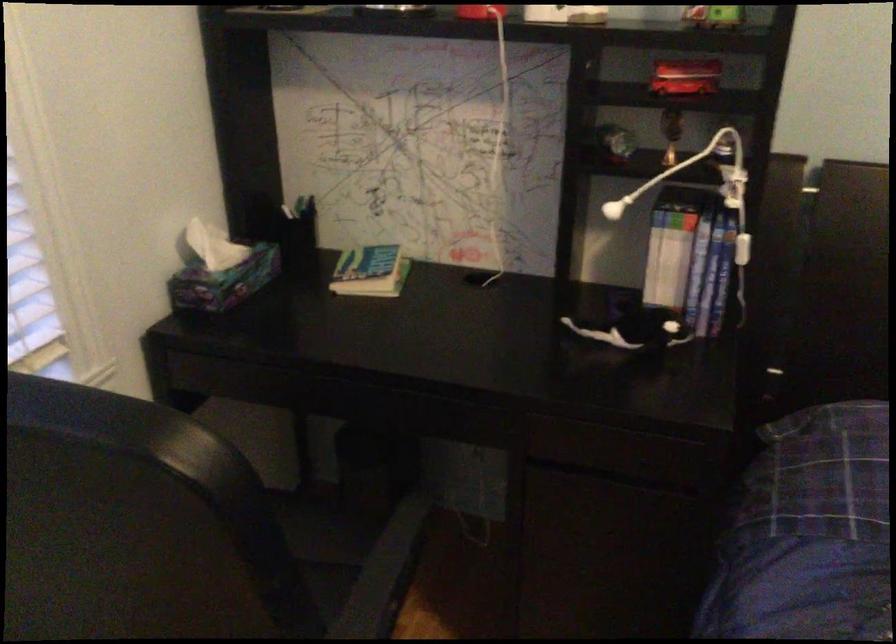
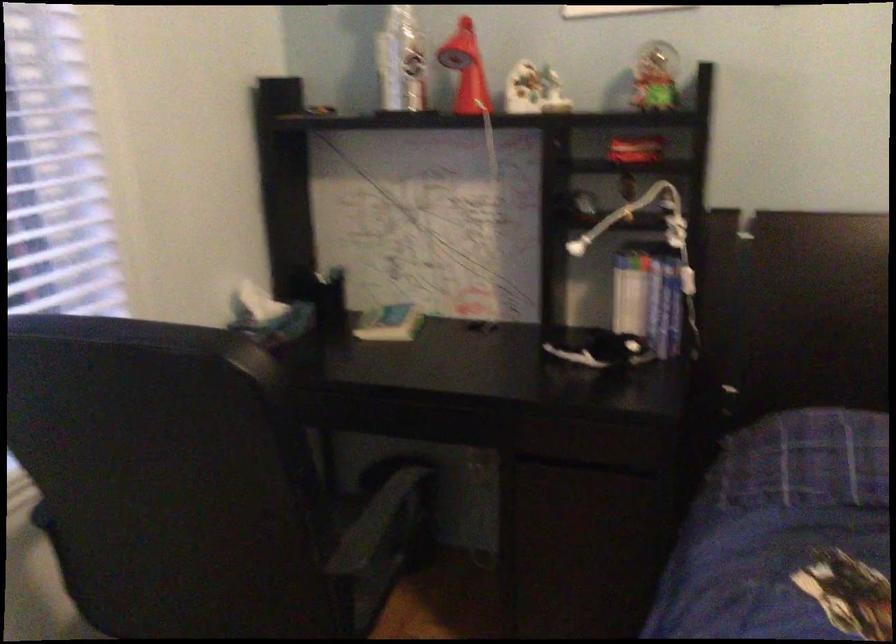
Find the pixel in the second image that matches (x=609, y=212) in the first image.

(576, 247)